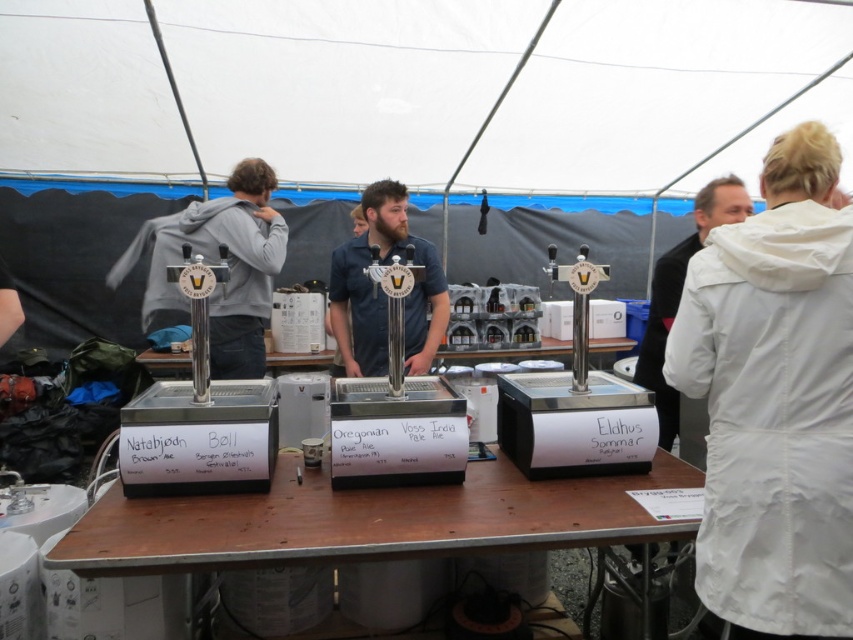
Question: Among these points, which one is nearest to the camera?

Choices:
 (A) (607, 536)
 (B) (354, 337)
 (C) (715, 348)
 (D) (669, 445)

Answer: (C)

Question: In this image, where is white matte lab coat at right located relative to blue denim shirt at center?

Choices:
 (A) right
 (B) left

Answer: (A)

Question: Which of the following is the closest to the observer?

Choices:
 (A) (657, 362)
 (B) (572, 484)

Answer: (B)

Question: Can you confirm if white matte lab coat at right is thinner than blue denim shirt at center?

Choices:
 (A) yes
 (B) no

Answer: (A)

Question: Is the position of blue denim shirt at center more distant than that of white matte jacket at right?

Choices:
 (A) yes
 (B) no

Answer: (B)

Question: Which object is the farthest from the wooden table at center?

Choices:
 (A) white matte jacket at right
 (B) matte gray hoodie at left
 (C) white matte lab coat at right

Answer: (B)